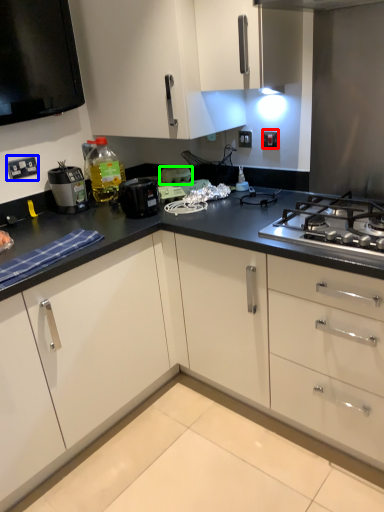
Question: Based on their relative distances, which object is nearer to electric outlet (highlighted by a red box)? Choose from electric outlet (highlighted by a blue box) and appliance (highlighted by a green box).

Choices:
 (A) electric outlet
 (B) appliance

Answer: (B)